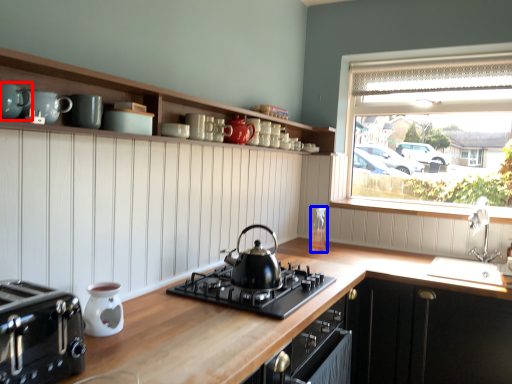
Question: Which point is closer to the camera, teal (highlighted by a red box) or bottle (highlighted by a blue box)?

Choices:
 (A) teal
 (B) bottle

Answer: (A)